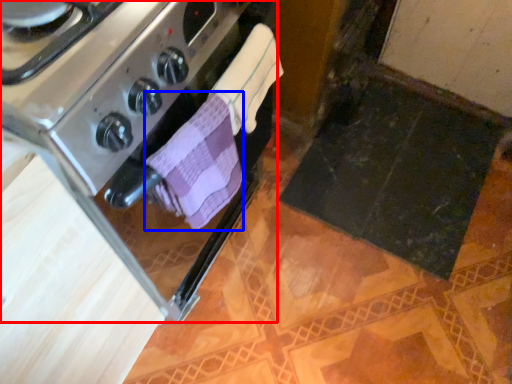
Question: Which of the following is the farthest to the observer, kitchen appliance (highlighted by a red box) or bath towel (highlighted by a blue box)?

Choices:
 (A) kitchen appliance
 (B) bath towel

Answer: (B)